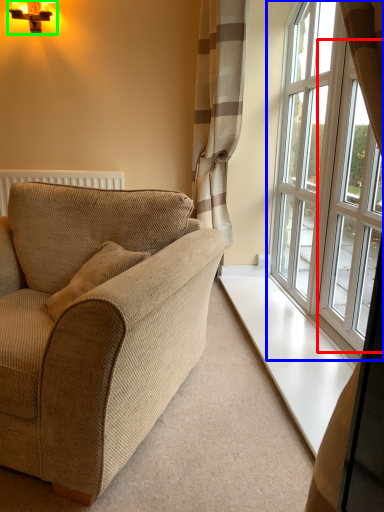
Question: Based on their relative distances, which object is farther from window (highlighted by a red box)? Choose from window (highlighted by a blue box) and light fixture (highlighted by a green box).

Choices:
 (A) window
 (B) light fixture

Answer: (B)